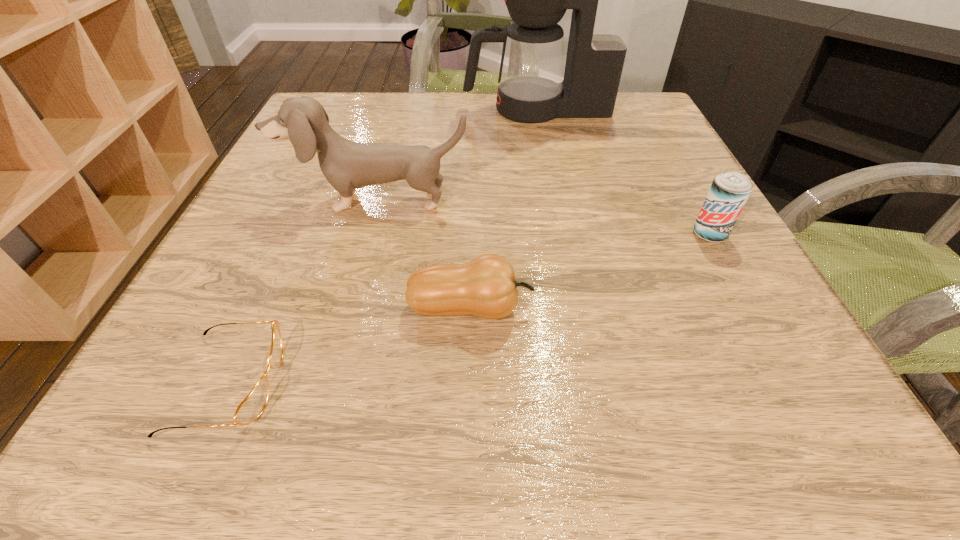
Locate an element on the screen. The image size is (960, 540). vacant region located 0.380m pour from the carafe of the farthest object is located at coordinates (308, 109).

The width and height of the screenshot is (960, 540). Identify the location of vacant space located 0.150m pour from the carafe of the farthest object. (402, 109).

I want to click on vacant space located 0.360m pour from the carafe of the farthest object, so click(x=317, y=109).

Where is `free space located 0.380m at the face of the fourth shortest object`? This screenshot has height=540, width=960. free space located 0.380m at the face of the fourth shortest object is located at coordinates (318, 414).

Find the location of `free space located 0.270m on the front of the beer can`. free space located 0.270m on the front of the beer can is located at coordinates (796, 390).

Locate an element on the screen. vacant area situated 0.090m on the stem side of the gourd is located at coordinates [x=594, y=308].

Where is `vacant point located on the front-facing side of the spectacles`? The height and width of the screenshot is (540, 960). vacant point located on the front-facing side of the spectacles is located at coordinates (317, 383).

Identify the location of object at the far edge. (531, 89).

Find the location of a particular element. Image resolution: width=960 pixels, height=540 pixels. object positioned at the near edge is located at coordinates (252, 406).

You are a GUI agent. You are given a task and a screenshot of the screen. Output one action in this format:
    pyautogui.click(x=<x>, y=<y>)
    Task: Click on the puppy at the left edge
    The height and width of the screenshot is (540, 960).
    Given the screenshot: What is the action you would take?
    pyautogui.click(x=347, y=165)